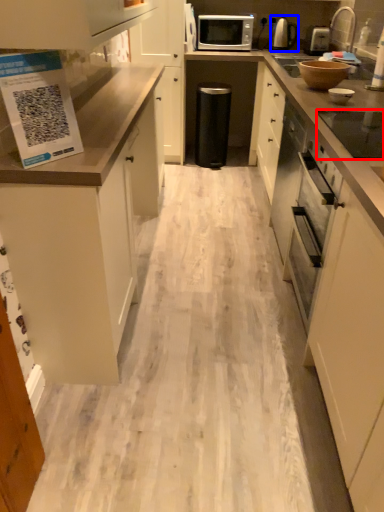
Question: Which of the following is the farthest to the observer, appliance (highlighted by a red box) or kitchen appliance (highlighted by a blue box)?

Choices:
 (A) appliance
 (B) kitchen appliance

Answer: (B)